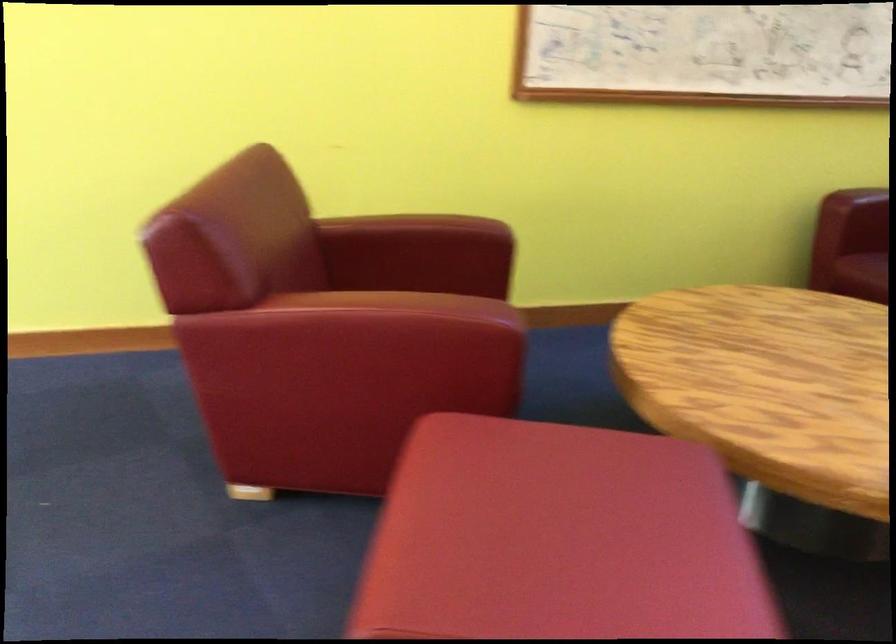
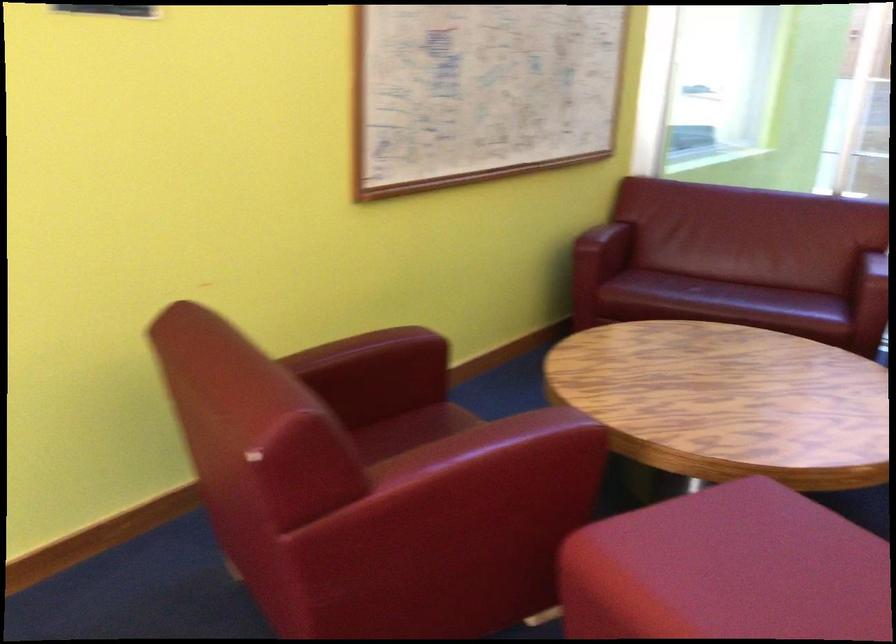
Question: I am providing you with two images of the same scene from different viewpoints. After the viewpoint changes to image2, which objects are now occluded?

Choices:
 (A) chair sitting surface
 (B) red footstool
 (C) sofa sitting surface
 (D) none of these

Answer: (D)